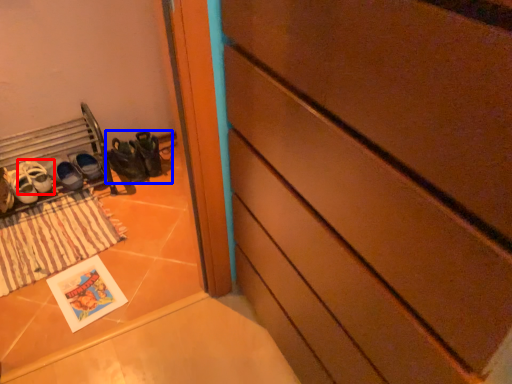
Question: Which object appears closest to the camera in this image, footwear (highlighted by a red box) or footwear (highlighted by a blue box)?

Choices:
 (A) footwear
 (B) footwear

Answer: (A)